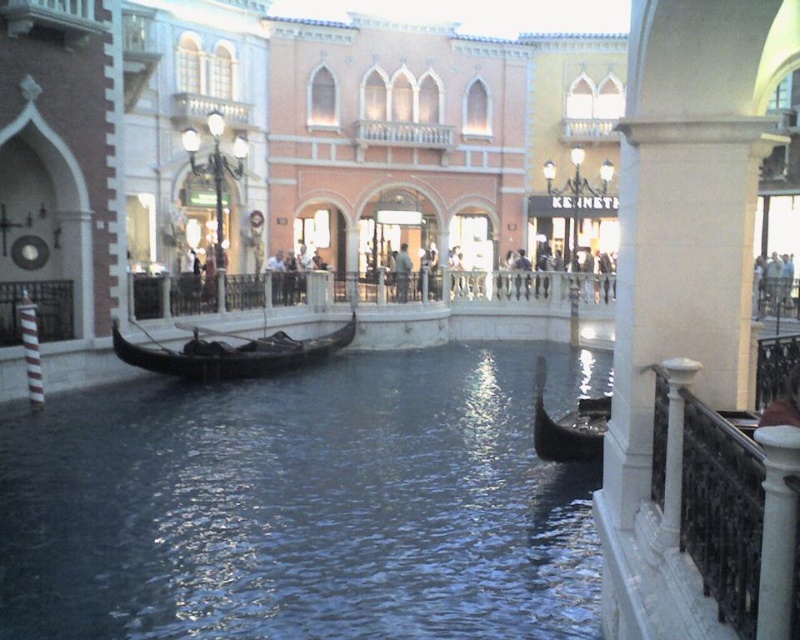
Is wooden gondola at lower right smaller than dark gray fabric jacket at center?

Actually, wooden gondola at lower right might be larger than dark gray fabric jacket at center.

Is point (564, 458) more distant than point (394, 256)?

That is False.

What do you see at coordinates (568, 426) in the screenshot? I see `wooden gondola at lower right` at bounding box center [568, 426].

Where is `wooden gondola at lower right`? wooden gondola at lower right is located at coordinates (568, 426).

Can you confirm if black polished wood gondola at center is smaller than dark gray fabric jacket at center?

No.

Between black polished wood gondola at center and dark gray fabric jacket at center, which one is positioned lower?

black polished wood gondola at center is below.

Between point (325, 342) and point (394, 260), which one is positioned behind?

The point (394, 260) is behind.

Where is `black polished wood gondola at center`? black polished wood gondola at center is located at coordinates (230, 353).

Which is behind, point (49, 609) or point (408, 260)?

Positioned behind is point (408, 260).

Between clear water at center and dark gray fabric jacket at center, which one has more height?

With more height is dark gray fabric jacket at center.

At what (x,y) coordinates should I click in order to perform the action: click on clear water at center. Please return your answer as a coordinate pair (x, y). This screenshot has height=640, width=800. Looking at the image, I should click on (304, 506).

Locate an element on the screen. This screenshot has width=800, height=640. clear water at center is located at coordinates (304, 506).